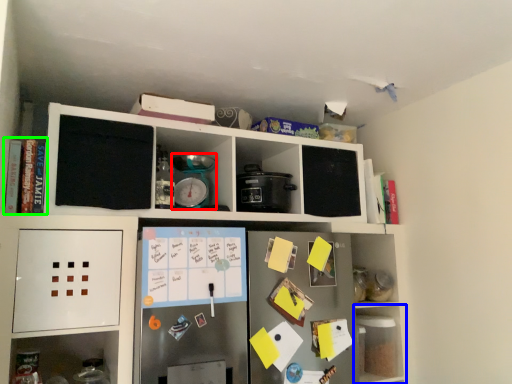
Question: Estimate the real-world distances between objects in this image. Which object is farther from appliance (highlighted by a red box), shelf (highlighted by a blue box) or book (highlighted by a green box)?

Choices:
 (A) shelf
 (B) book

Answer: (A)